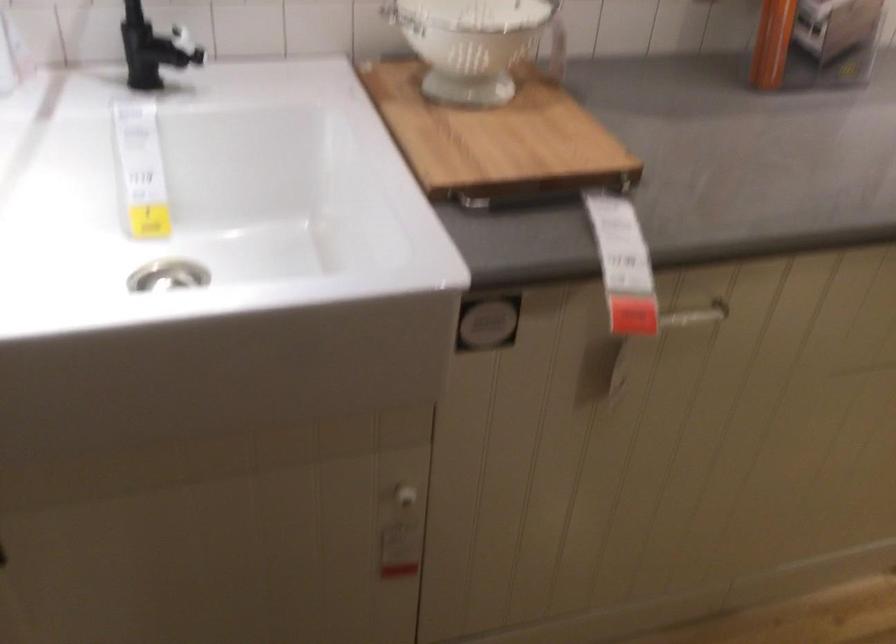
Where is `white cabinet knob`? The height and width of the screenshot is (644, 896). white cabinet knob is located at coordinates (403, 497).